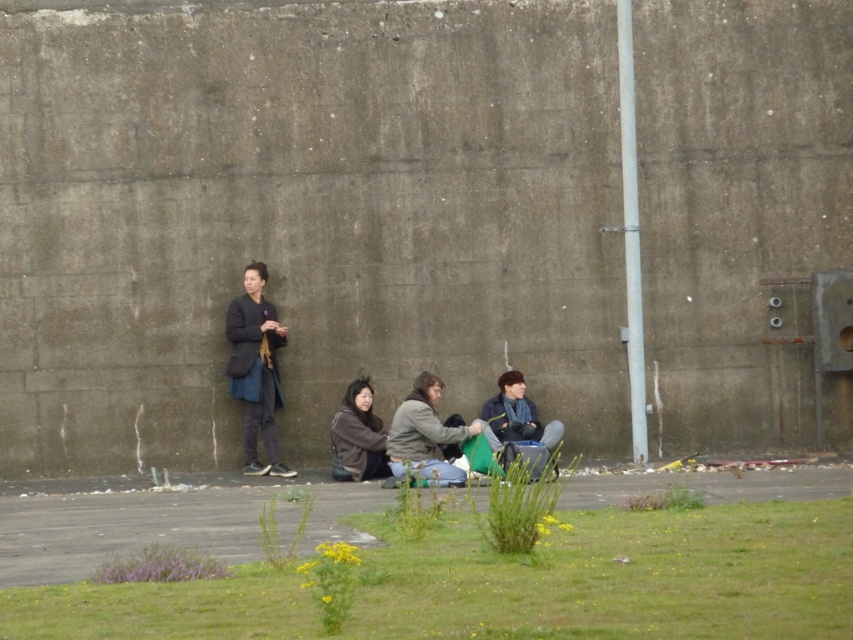
You are standing in front of the concrete wall and want to place a small potted plant between the green grass at lower center and the brown fuzzy jacket at lower center. Based on their positions, which object should the potted plant be closer to?

The green grass at lower center is closer to the viewer than the brown fuzzy jacket at lower center. Therefore, the potted plant should be placed closer to the green grass at lower center to maintain proximity to the viewer.

In the scene shown: You are organizing a photo shoot and need to know if the matte gray jacket at center can fit within the frame of the dark blue jacket at center without overlapping. Can you determine if this is possible based on their sizes?

The matte gray jacket at center might be wider than dark blue jacket at center, so there is a possibility that the matte gray jacket at center could overlap the dark blue jacket at center if placed within the same frame.

From the picture: You are a gardener who wants to mow the green grass at lower center. However, there is a brown fuzzy jacket at lower center in the way. Can you mow the grass without moving the jacket?

The green grass at lower center is not as tall as brown fuzzy jacket at lower center, so the jacket is taller than the grass. Since the jacket is taller, it might block the mower, so you should move the jacket before mowing.